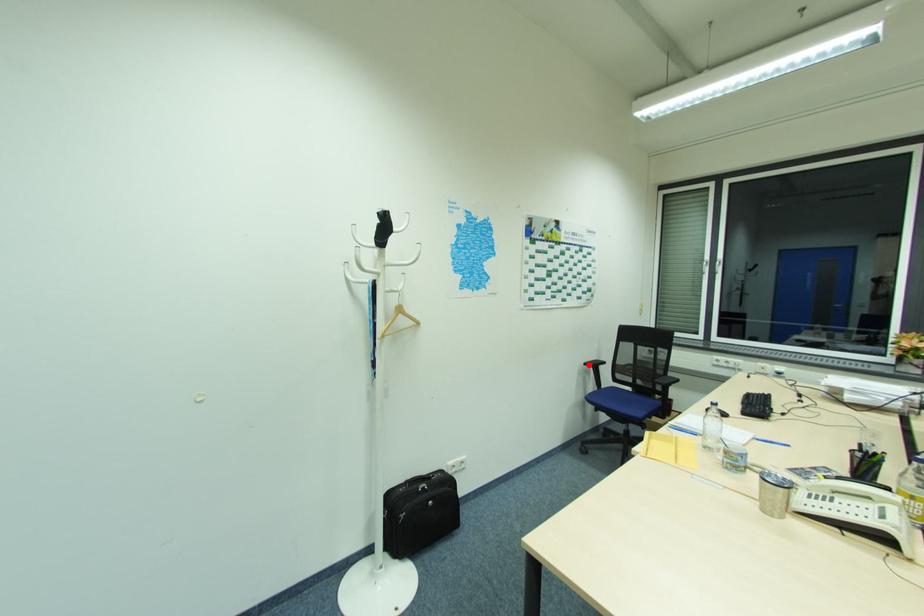
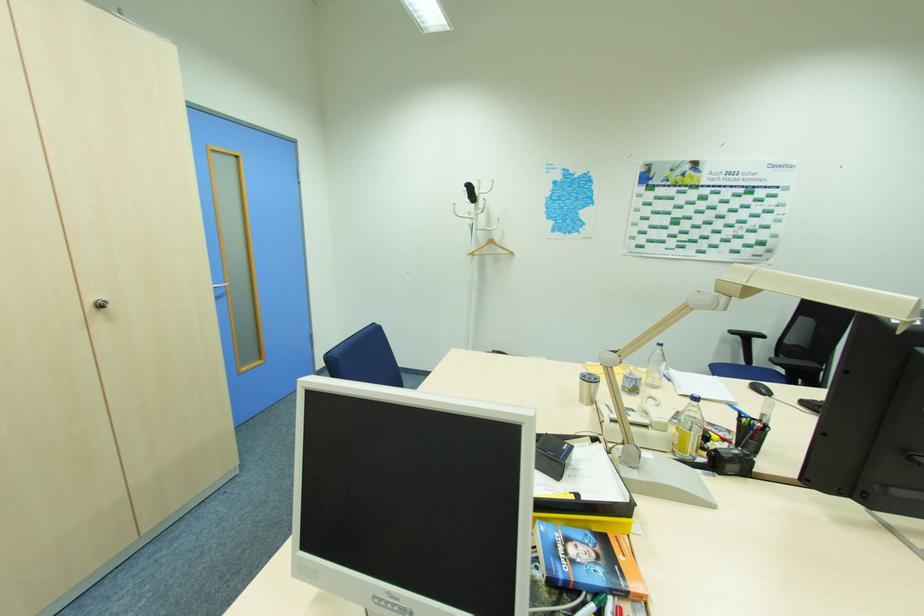
Locate, in the second image, the point that corresponds to the highlighted location in the first image.

(734, 331)